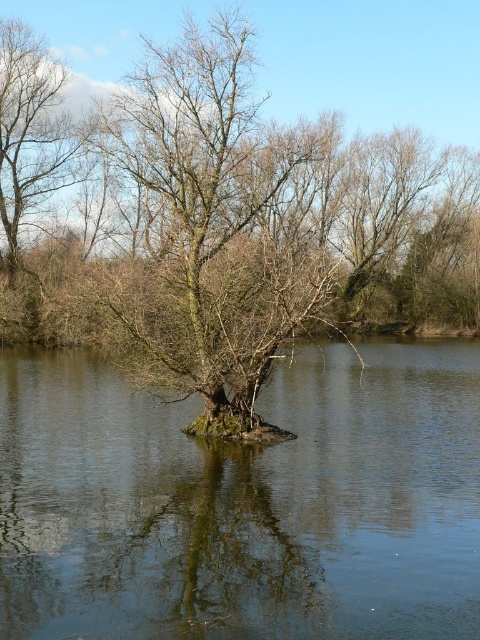
Question: Can you confirm if greenish-brown mud at center is positioned to the left of green leafy tree at center?

Choices:
 (A) yes
 (B) no

Answer: (B)

Question: Is green leafy tree at center above greenish reflective water at center?

Choices:
 (A) no
 (B) yes

Answer: (B)

Question: Is greenish-brown mud at center closer to the viewer compared to greenish reflective water at center?

Choices:
 (A) yes
 (B) no

Answer: (A)

Question: Which point is closer to the camera?

Choices:
 (A) (447, 35)
 (B) (217, 449)

Answer: (B)

Question: Which point is closer to the camera?

Choices:
 (A) (423, 0)
 (B) (311, 627)
 (C) (171, 588)

Answer: (B)

Question: Considering the real-world distances, which object is farthest from the greenish-brown mud at center?

Choices:
 (A) greenish reflective water at center
 (B) green leafy tree at center

Answer: (B)